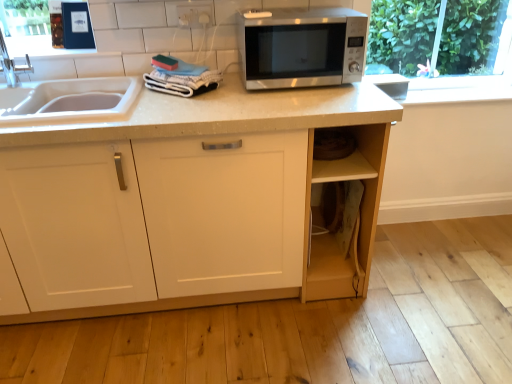
Question: Is white plastic electric outlet at upper center thinner than matte white cabinet at center?

Choices:
 (A) no
 (B) yes

Answer: (B)

Question: Is the depth of white plastic electric outlet at upper center greater than that of matte white cabinet at center?

Choices:
 (A) yes
 (B) no

Answer: (A)

Question: Can you confirm if white plastic electric outlet at upper center is shorter than matte white cabinet at center?

Choices:
 (A) yes
 (B) no

Answer: (A)

Question: Does white plastic electric outlet at upper center contain matte white cabinet at center?

Choices:
 (A) yes
 (B) no

Answer: (B)

Question: Considering the relative sizes of white plastic electric outlet at upper center and matte white cabinet at center in the image provided, is white plastic electric outlet at upper center taller than matte white cabinet at center?

Choices:
 (A) yes
 (B) no

Answer: (B)

Question: In terms of width, does matte white cabinet at center look wider or thinner when compared to satin silver microwave at center?

Choices:
 (A) wide
 (B) thin

Answer: (A)

Question: Considering the positions of matte white cabinet at center and satin silver microwave at center in the image, is matte white cabinet at center taller or shorter than satin silver microwave at center?

Choices:
 (A) tall
 (B) short

Answer: (A)

Question: From the image's perspective, is matte white cabinet at center above or below satin silver microwave at center?

Choices:
 (A) below
 (B) above

Answer: (A)

Question: In the image, is matte white cabinet at center on the left side or the right side of satin silver microwave at center?

Choices:
 (A) left
 (B) right

Answer: (A)

Question: Which is correct: satin silver microwave at center is inside white plastic electric outlet at upper center, or outside of it?

Choices:
 (A) inside
 (B) outside

Answer: (B)

Question: Considering the positions of satin silver microwave at center and white plastic electric outlet at upper center in the image, is satin silver microwave at center wider or thinner than white plastic electric outlet at upper center?

Choices:
 (A) wide
 (B) thin

Answer: (A)

Question: From the image's perspective, is satin silver microwave at center above or below white plastic electric outlet at upper center?

Choices:
 (A) below
 (B) above

Answer: (A)

Question: Is satin silver microwave at center in front of or behind white plastic electric outlet at upper center in the image?

Choices:
 (A) behind
 (B) front

Answer: (B)

Question: From the image's perspective, is satin silver microwave at center positioned above or below matte white cabinet at center?

Choices:
 (A) below
 (B) above

Answer: (B)

Question: In terms of size, does satin silver microwave at center appear bigger or smaller than matte white cabinet at center?

Choices:
 (A) small
 (B) big

Answer: (A)